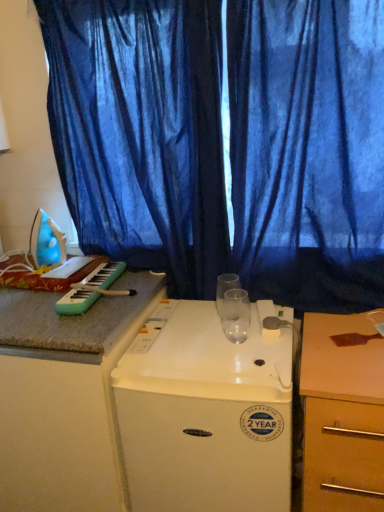
This screenshot has width=384, height=512. I want to click on vacant space situated above wooden at right (from a real-world perspective), so click(344, 339).